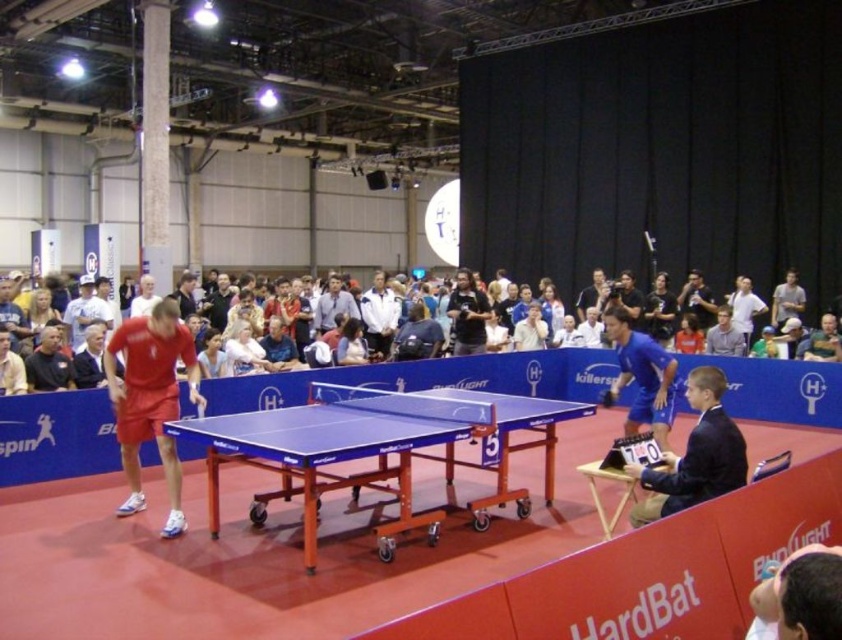
Question: Is blue plastic table at center smaller than white matte jacket at center?

Choices:
 (A) yes
 (B) no

Answer: (A)

Question: Is dark blue shirt at center to the left of light gray fabric shirt at center from the viewer's perspective?

Choices:
 (A) no
 (B) yes

Answer: (B)

Question: Does white cotton shirt at center appear on the right side of light gray fabric shirt at center?

Choices:
 (A) yes
 (B) no

Answer: (B)

Question: Which point is farther to the camera?

Choices:
 (A) click(493, 444)
 (B) click(382, 285)
 (C) click(704, 323)
 (D) click(779, 396)

Answer: (C)

Question: Estimate the real-world distances between objects in this image. Which object is closer to the dark blue suit at right?

Choices:
 (A) white cotton shirt at center
 (B) blue plastic table at center

Answer: (B)

Question: Among these objects, which one is nearest to the camera?

Choices:
 (A) dark blue shirt at center
 (B) white cotton shirt at center
 (C) matte red shorts at left
 (D) blue plastic table at center

Answer: (D)